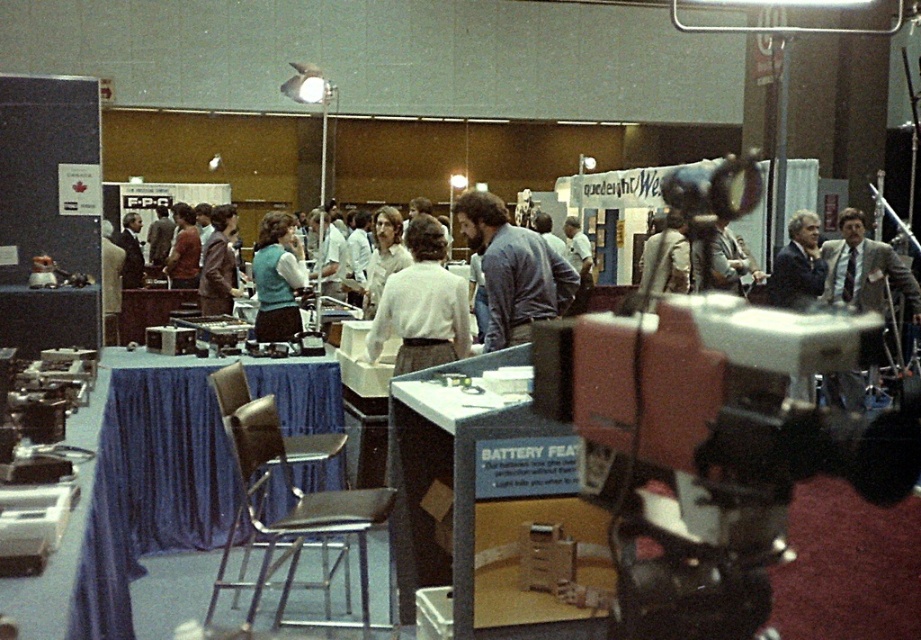
Looking at this image, does matte black video camera at center have a larger size compared to gray suit at upper right?

Yes, matte black video camera at center is bigger than gray suit at upper right.

Does point (669, 557) lie behind point (859, 264)?

No, (669, 557) is in front of (859, 264).

Between point (644, 339) and point (826, 268), which one is positioned behind?

Positioned behind is point (826, 268).

Locate an element on the screen. matte black video camera at center is located at coordinates (702, 460).

Is the position of gray suit at upper right more distant than that of blue fabric vest at center?

No, gray suit at upper right is in front of blue fabric vest at center.

Where is `gray suit at upper right`? The width and height of the screenshot is (921, 640). gray suit at upper right is located at coordinates (863, 268).

Identify the location of gray suit at upper right. The image size is (921, 640). (863, 268).

Which is above, matte blue vest at center or blue denim vest at center?

blue denim vest at center

Is matte blue vest at center wider than blue denim vest at center?

No, matte blue vest at center is not wider than blue denim vest at center.

The image size is (921, 640). What are the coordinates of `matte blue vest at center` in the screenshot? It's located at (276, 280).